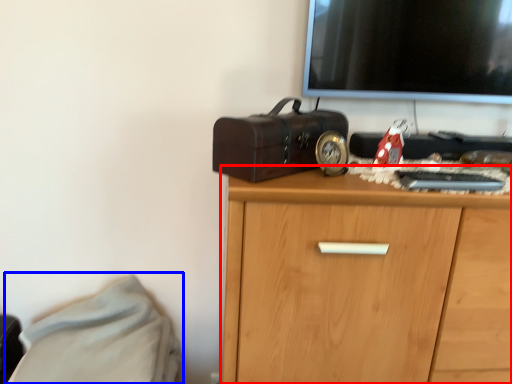
Question: Among these objects, which one is farthest to the camera, chest of drawers (highlighted by a red box) or bed (highlighted by a blue box)?

Choices:
 (A) chest of drawers
 (B) bed

Answer: (B)